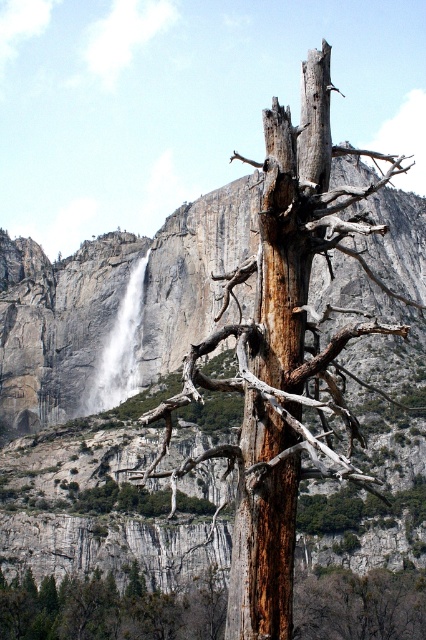
Question: Which object appears closest to the camera in this image?

Choices:
 (A) brown wood tree at center
 (B) white textured waterfall at center
 (C) smooth gray rock at center

Answer: (A)

Question: In this image, where is smooth gray rock at center located relative to brown rough bark tree at center?

Choices:
 (A) below
 (B) above

Answer: (B)

Question: Which point appears farthest from the camera in this image?

Choices:
 (A) (183, 289)
 (B) (120, 365)
 (C) (382, 572)
 (D) (282, 397)

Answer: (A)

Question: Where is brown wood tree at center located in relation to brown rough bark tree at center in the image?

Choices:
 (A) below
 (B) above

Answer: (B)

Question: Can you confirm if brown rough bark tree at center is smaller than white textured waterfall at center?

Choices:
 (A) no
 (B) yes

Answer: (B)

Question: Which object is the closest to the brown wood tree at center?

Choices:
 (A) smooth gray rock at center
 (B) brown rough bark tree at center

Answer: (B)